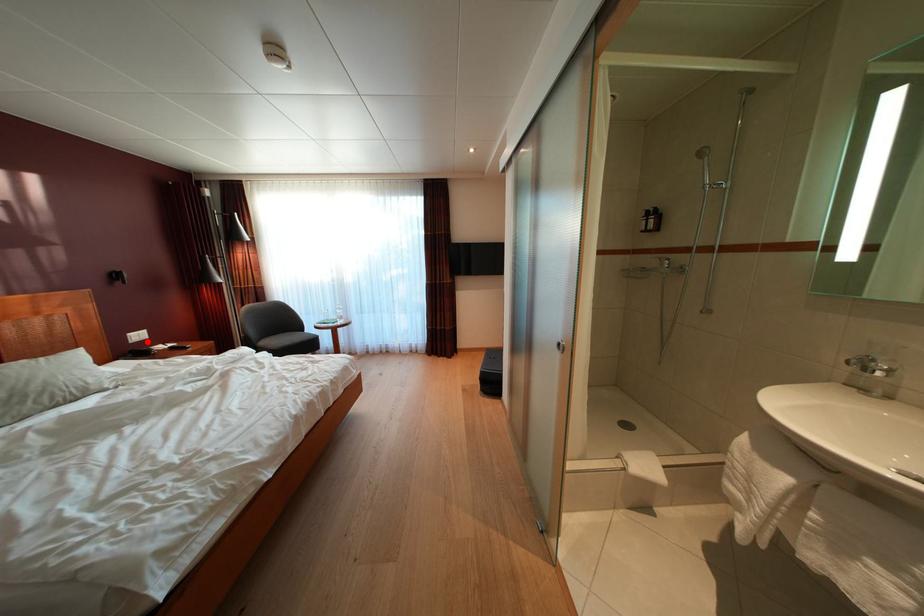
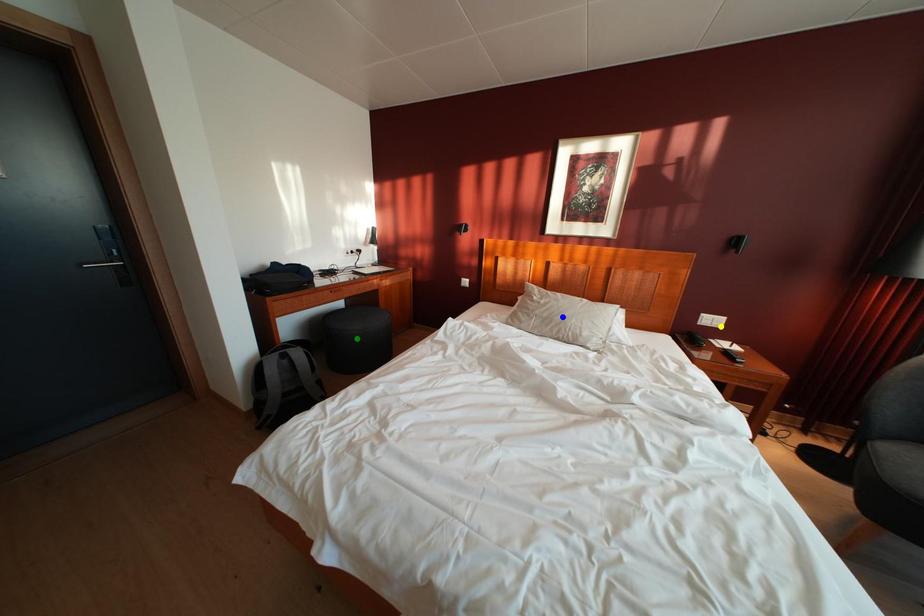
Question: I am providing you with two images of the same scene from different viewpoints. A red point is marked on the first image. You are given multiple points on the second image. Which mark in image 2 goes with the point in image 1?

Choices:
 (A) green point
 (B) blue point
 (C) yellow point

Answer: (C)